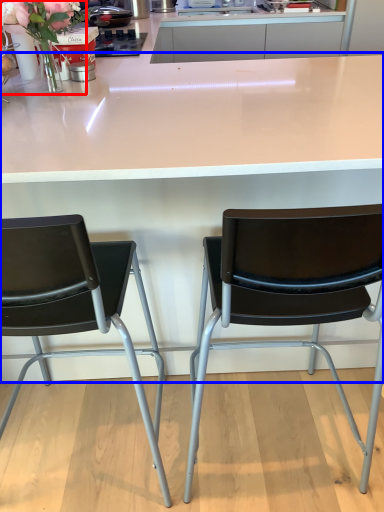
Question: Which point is further to the camera, floral arrangement (highlighted by a red box) or table (highlighted by a blue box)?

Choices:
 (A) floral arrangement
 (B) table

Answer: (A)